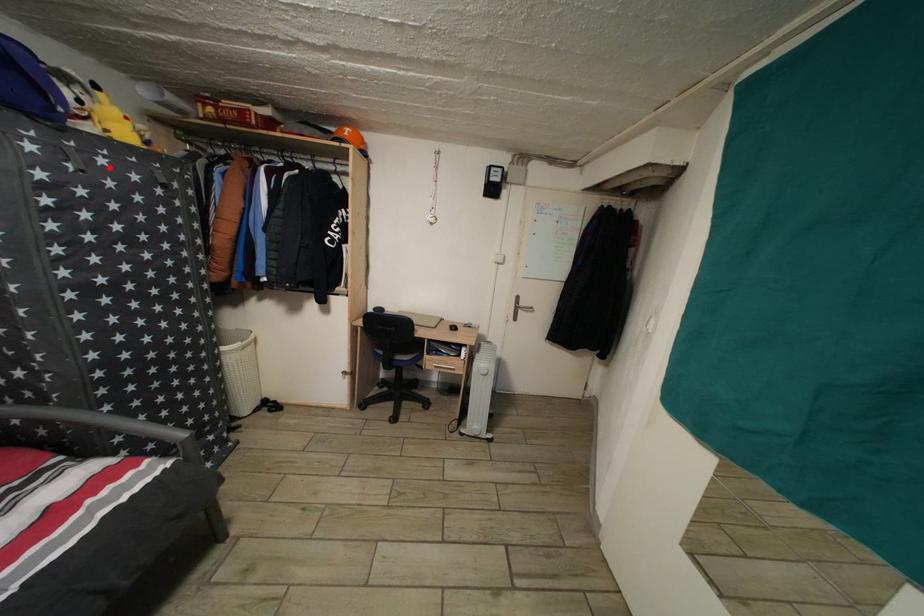
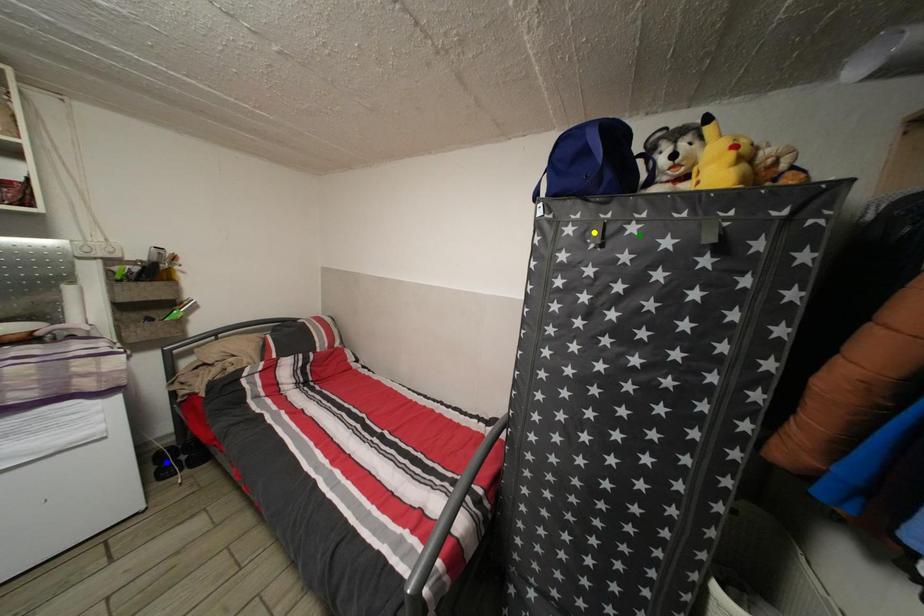
Question: I am providing you with two images of the same scene from different viewpoints. A red point is marked on the first image. You are given multiple points on the second image. Which spot in image 2 lines up with the point in image 1?

Choices:
 (A) green point
 (B) yellow point
 (C) blue point

Answer: (A)